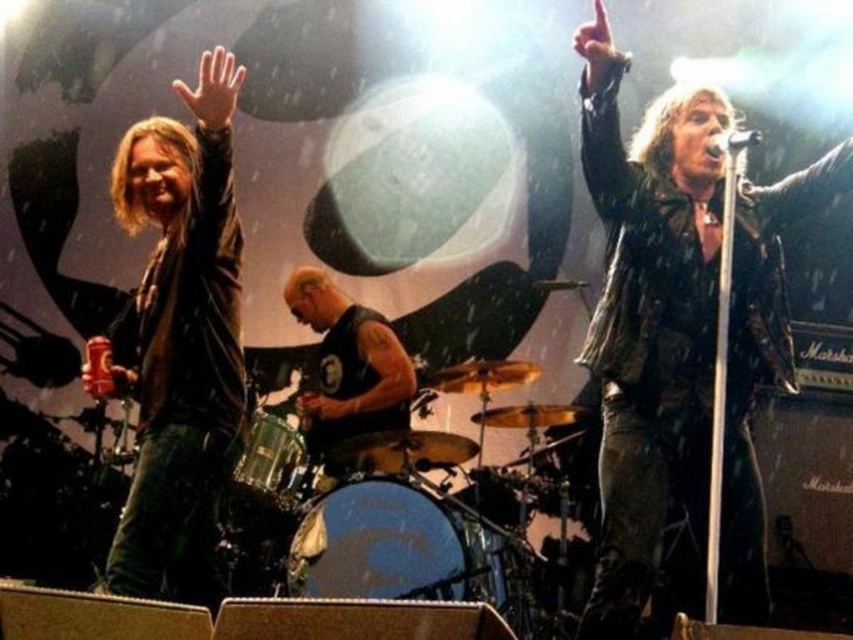
You are a photographer at the concert venue. You need to position a spotlight on the stage so that it shines between the matte black leather jacket at left and the shiny metallic drum at center. Is there enough space between them to place the spotlight?

The matte black leather jacket at left is to the left of the shiny metallic drum at center, so there is space between them to place the spotlight.

You are standing in the concert venue and want to take a photo of the point at coordinates (x=596, y=188). The camera you have can only focus on objects within 2.5 meters. Will the point be in focus?

The point at coordinates (x=596, y=188) is 2.60 meters from the viewer, which is beyond the camera focus range of 2.5 meters. Therefore, the point will not be in focus.